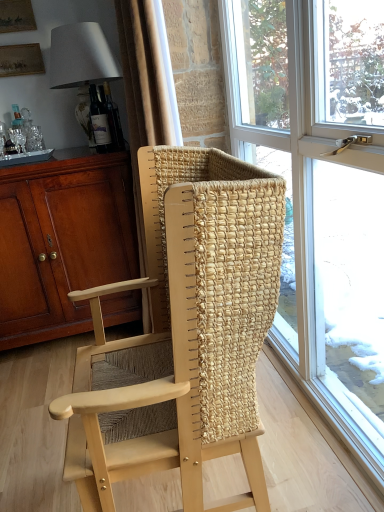
The width and height of the screenshot is (384, 512). What are the coordinates of `free space to the right of natural woven wood chair at center` in the screenshot? It's located at (303, 450).